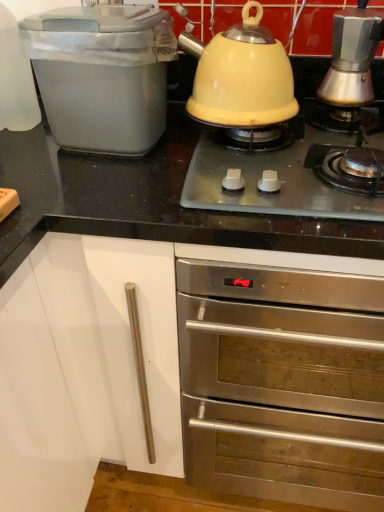
Question: Can you confirm if stainless steel oven at upper center is positioned to the right of yellow enameled kettle at upper center?

Choices:
 (A) no
 (B) yes

Answer: (B)

Question: From the image's perspective, does stainless steel oven at upper center appear higher than yellow enameled kettle at upper center?

Choices:
 (A) yes
 (B) no

Answer: (B)

Question: Is stainless steel oven at upper center oriented away from yellow enameled kettle at upper center?

Choices:
 (A) yes
 (B) no

Answer: (B)

Question: Considering the relative sizes of stainless steel oven at upper center and yellow enameled kettle at upper center in the image provided, is stainless steel oven at upper center thinner than yellow enameled kettle at upper center?

Choices:
 (A) no
 (B) yes

Answer: (A)

Question: From a real-world perspective, is stainless steel oven at upper center located higher than yellow enameled kettle at upper center?

Choices:
 (A) no
 (B) yes

Answer: (A)

Question: Is stainless steel oven at upper center directly adjacent to yellow enameled kettle at upper center?

Choices:
 (A) no
 (B) yes

Answer: (A)

Question: Can you confirm if yellow enameled kettle at upper center is positioned to the right of yellow matte kettle at center?

Choices:
 (A) yes
 (B) no

Answer: (A)

Question: Can you confirm if yellow enameled kettle at upper center is taller than yellow matte kettle at center?

Choices:
 (A) yes
 (B) no

Answer: (B)

Question: Is yellow enameled kettle at upper center positioned beyond the bounds of yellow matte kettle at center?

Choices:
 (A) no
 (B) yes

Answer: (B)

Question: Is yellow enameled kettle at upper center closer to camera compared to yellow matte kettle at center?

Choices:
 (A) no
 (B) yes

Answer: (B)

Question: From the image's perspective, is yellow enameled kettle at upper center located beneath yellow matte kettle at center?

Choices:
 (A) yes
 (B) no

Answer: (A)

Question: From the image's perspective, would you say yellow enameled kettle at upper center is positioned over yellow matte kettle at center?

Choices:
 (A) yes
 (B) no

Answer: (B)

Question: Is matte plastic bread bin at left, the 1th kitchen appliance viewed from the left, positioned before yellow enameled kettle at upper center?

Choices:
 (A) no
 (B) yes

Answer: (A)